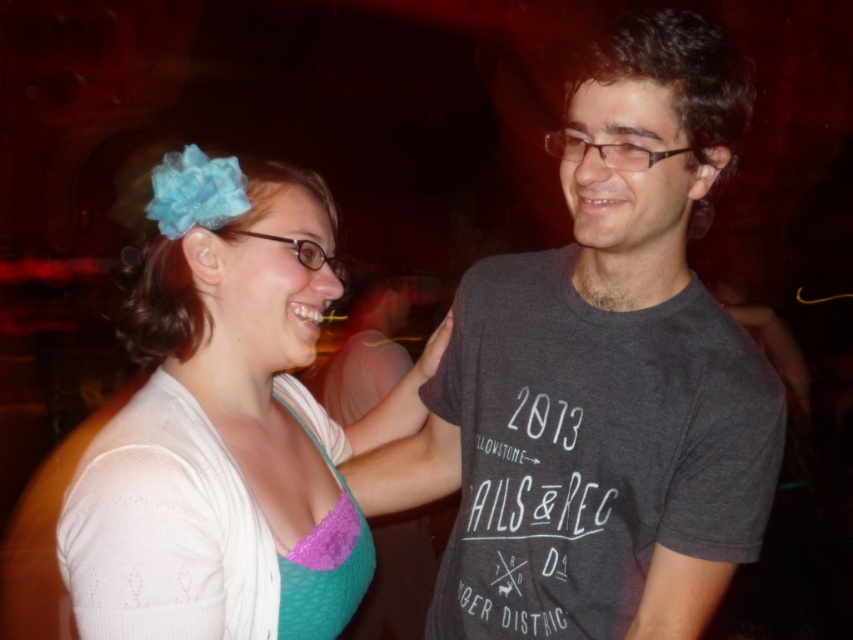
Question: Which point appears closest to the camera in this image?

Choices:
 (A) (297, 611)
 (B) (373, 490)
 (C) (361, 516)

Answer: (A)

Question: Is matte blue fabric flower at upper left in front of purple lace bikini top at left?

Choices:
 (A) yes
 (B) no

Answer: (B)

Question: Among these points, which one is farthest from the camera?

Choices:
 (A) (312, 516)
 (B) (560, 564)
 (C) (136, 532)

Answer: (B)

Question: Can you confirm if gray cotton t-shirt at center is thinner than matte blue fabric flower at upper left?

Choices:
 (A) no
 (B) yes

Answer: (A)

Question: Where is gray cotton t-shirt at center located in relation to purple lace bikini top at left in the image?

Choices:
 (A) left
 (B) right

Answer: (B)

Question: Among these points, which one is nearest to the camera?

Choices:
 (A) (129, 484)
 (B) (538, 401)

Answer: (A)